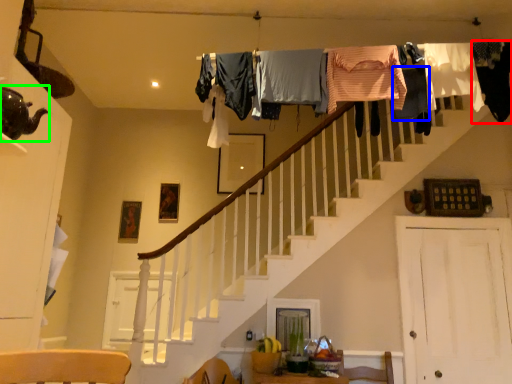
Question: Which object is the closest to the clothing (highlighted by a red box)? Choose among these: clothing (highlighted by a blue box) or tea pot (highlighted by a green box).

Choices:
 (A) clothing
 (B) tea pot

Answer: (A)